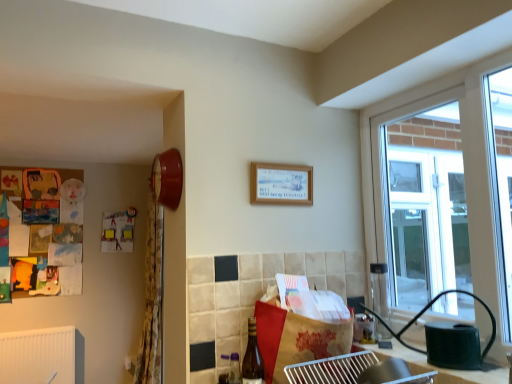
What do you see at coordinates (167, 178) in the screenshot? I see `matte red clock at upper left` at bounding box center [167, 178].

Measure the distance between metallic silver tray at lower center and camera.

A distance of 4.63 feet exists between metallic silver tray at lower center and camera.

Where is `yellow floral fabric curtain at left`? yellow floral fabric curtain at left is located at coordinates (152, 299).

Describe the element at coordinates (152, 299) in the screenshot. The image size is (512, 384). I see `yellow floral fabric curtain at left` at that location.

Describe the element at coordinates (281, 184) in the screenshot. I see `wooden picture frame at upper center` at that location.

Find the location of a particular element. Image resolution: width=512 pixels, height=384 pixels. wooden picture frame at upper center is located at coordinates (281, 184).

The width and height of the screenshot is (512, 384). I want to click on matte red clock at upper left, so click(167, 178).

Is matte red clock at upper left inside or outside of yellow floral fabric curtain at left?

matte red clock at upper left is spatially situated outside yellow floral fabric curtain at left.

Which of these two, matte red clock at upper left or yellow floral fabric curtain at left, is bigger?

Bigger between the two is yellow floral fabric curtain at left.

In the scene shown: From a real-world perspective, is matte red clock at upper left physically located above or below yellow floral fabric curtain at left?

From a real-world perspective, matte red clock at upper left is physically above yellow floral fabric curtain at left.

Considering the positions of point (180, 165) and point (141, 355), is point (180, 165) closer or farther from the camera than point (141, 355)?

Point (180, 165) is closer to the camera than point (141, 355).

Which of these two, brown paper bag at center or matte red clock at upper left, is wider?

brown paper bag at center.

Does brown paper bag at center contain matte red clock at upper left?

Definitely not — matte red clock at upper left is not inside brown paper bag at center.

Locate an element on the screen. The height and width of the screenshot is (384, 512). cardboard box below the matte red clock at upper left (from the image's perspective) is located at coordinates (296, 339).

Does point (258, 332) come behind point (155, 169)?

No, it is not.

Choose the correct answer: Is wooden picture frame at upper center inside brown paper bag at center or outside it?

wooden picture frame at upper center exists outside the volume of brown paper bag at center.

How different are the orientations of wooden picture frame at upper center and brown paper bag at center in degrees?

wooden picture frame at upper center and brown paper bag at center are facing 0.789 degrees away from each other.

From the image's perspective, does wooden picture frame at upper center appear higher than brown paper bag at center?

Indeed, from the image's perspective, wooden picture frame at upper center is shown above brown paper bag at center.

Which object is wider, wooden picture frame at upper center or brown paper bag at center?

brown paper bag at center is wider.

From a real-world perspective, between metallic silver tray at lower center and matte red clock at upper left, who is vertically higher?

From a 3D spatial view, matte red clock at upper left is above.

Looking at this image, measure the distance from metallic silver tray at lower center to matte red clock at upper left.

81.71 centimeters.

Between metallic silver tray at lower center and matte red clock at upper left, which one has larger size?

metallic silver tray at lower center.

Is metallic silver tray at lower center outside of matte red clock at upper left?

Indeed, metallic silver tray at lower center is completely outside matte red clock at upper left.

How many degrees apart are the facing directions of brown glass bottle at lower center and yellow floral fabric curtain at left?

0.231 degrees.

Would you say brown glass bottle at lower center is a long distance from yellow floral fabric curtain at left?

Yes.

Is yellow floral fabric curtain at left located within brown glass bottle at lower center?

No.

Between brown glass bottle at lower center and yellow floral fabric curtain at left, which one has larger width?

With larger width is yellow floral fabric curtain at left.

From the image's perspective, which one is positioned lower, brown glass bottle at lower center or wooden picture frame at upper center?

brown glass bottle at lower center is shown below in the image.

Considering the sizes of brown glass bottle at lower center and wooden picture frame at upper center in the image, is brown glass bottle at lower center bigger or smaller than wooden picture frame at upper center?

Considering their sizes, brown glass bottle at lower center takes up more space than wooden picture frame at upper center.

Is brown glass bottle at lower center at the left side of wooden picture frame at upper center?

Correct, you'll find brown glass bottle at lower center to the left of wooden picture frame at upper center.

Between brown glass bottle at lower center and wooden picture frame at upper center, which one has less height?

With less height is wooden picture frame at upper center.

Is point (173, 170) positioned before point (272, 367)?

No, (173, 170) is behind (272, 367).

Is matte red clock at upper left oriented away from brown paper bag at center?

That's not correct — matte red clock at upper left is not looking away from brown paper bag at center.

From the picture: Is matte red clock at upper left not within brown paper bag at center?

matte red clock at upper left is positioned outside brown paper bag at center.

Identify the location of curtain to the left of matte red clock at upper left. (152, 299).

Where is `clock above the brown paper bag at center (from a real-world perspective)`? clock above the brown paper bag at center (from a real-world perspective) is located at coordinates (167, 178).

Estimate the real-world distances between objects in this image. Which object is closer to brown paper bag at center, brown glass bottle at lower center or wooden picture frame at upper center?

brown glass bottle at lower center lies closer to brown paper bag at center than the other object.

When comparing their distances from matte red clock at upper left, does yellow floral fabric curtain at left or brown glass bottle at lower center seem further?

Based on the image, yellow floral fabric curtain at left appears to be further to matte red clock at upper left.

Which object lies further to the anchor point wooden picture frame at upper center, matte red clock at upper left or brown paper bag at center?

brown paper bag at center.

When comparing their distances from wooden picture frame at upper center, does brown paper bag at center or yellow floral fabric curtain at left seem further?

yellow floral fabric curtain at left.

From the image, which object appears to be farther from wooden picture frame at upper center, metallic silver tray at lower center or brown glass bottle at lower center?

metallic silver tray at lower center.

Based on their spatial positions, is metallic silver tray at lower center or wooden picture frame at upper center further from matte red clock at upper left?

metallic silver tray at lower center is positioned further to the anchor matte red clock at upper left.

Based on their spatial positions, is matte red clock at upper left or brown glass bottle at lower center closer to yellow floral fabric curtain at left?

matte red clock at upper left is closer to yellow floral fabric curtain at left.

Considering their positions, is brown paper bag at center positioned further to yellow floral fabric curtain at left than matte red clock at upper left?

brown paper bag at center is positioned further to the anchor yellow floral fabric curtain at left.

The image size is (512, 384). Find the location of `cardboard box between matte red clock at upper left and brown glass bottle at lower center from top to bottom`. cardboard box between matte red clock at upper left and brown glass bottle at lower center from top to bottom is located at coordinates (x=296, y=339).

Where is `cardboard box between metallic silver tray at lower center and wooden picture frame at upper center in the front-back direction`? The height and width of the screenshot is (384, 512). cardboard box between metallic silver tray at lower center and wooden picture frame at upper center in the front-back direction is located at coordinates (296, 339).

Locate an element on the screen. This screenshot has height=384, width=512. clock between brown paper bag at center and yellow floral fabric curtain at left from front to back is located at coordinates (167, 178).

Locate an element on the screen. Image resolution: width=512 pixels, height=384 pixels. bottle between brown paper bag at center and yellow floral fabric curtain at left from front to back is located at coordinates (252, 358).